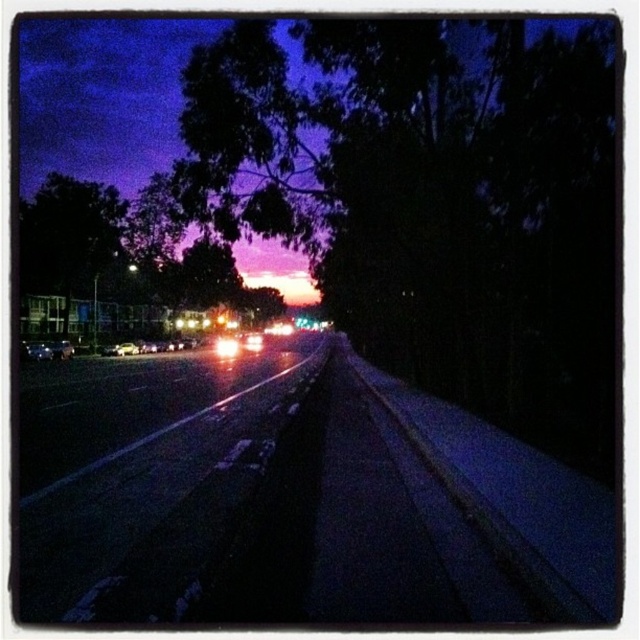
Question: Among these points, which one is farthest from the camera?

Choices:
 (A) (275, 428)
 (B) (72, 352)

Answer: (B)

Question: Based on their relative distances, which object is farther from the metallic reflective road at center?

Choices:
 (A) green leafy tree at center
 (B) bright white plastic headlight at center
 (C) shiny silver car at left

Answer: (A)

Question: Which point is closer to the camera taking this photo?

Choices:
 (A) (26, 353)
 (B) (65, 232)

Answer: (A)

Question: Observing the image, what is the correct spatial positioning of green leafy tree at center in reference to bright white plastic headlight at center?

Choices:
 (A) left
 (B) right

Answer: (A)

Question: Is metallic reflective road at center thinner than bright white plastic headlight at center?

Choices:
 (A) no
 (B) yes

Answer: (B)

Question: Does shiny silver car at left have a lesser width compared to bright white plastic headlight at center?

Choices:
 (A) yes
 (B) no

Answer: (A)